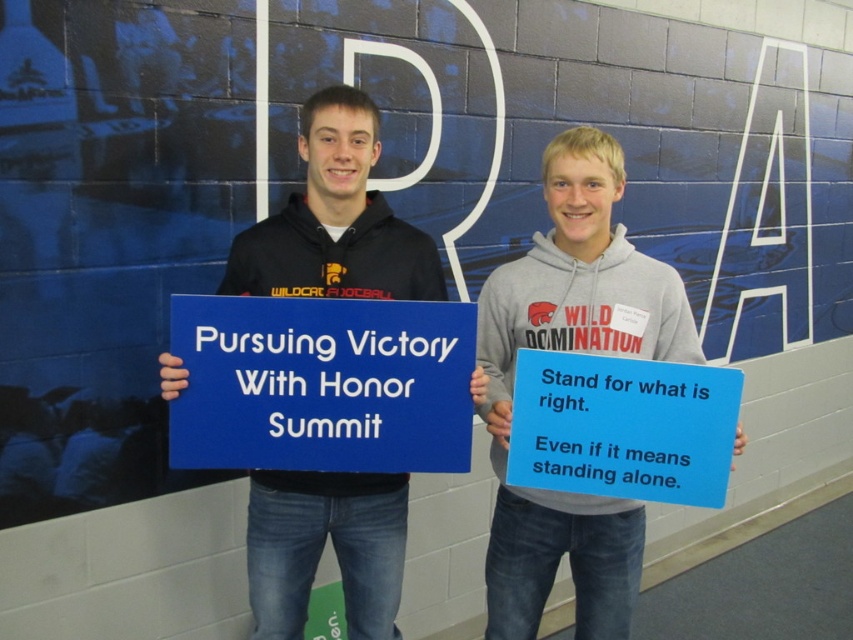
What is the relationship between the matte black hoodie at center and the blue cardstock sign at center in terms of their spatial positioning?

The blue cardstock sign at center is behind the matte black hoodie at center, so the sign is not visible from the front perspective.

You are organizing a community event and need to display two hoodies on a stand. You have a gray hoodie at center and a matte black hoodie at center. Which hoodie should you place on the higher stand to match their sizes as shown in the image?

The gray hoodie at center is taller than the matte black hoodie at center, so you should place the gray hoodie at center on the higher stand to match their sizes as shown in the image.

You are organizing a community event and need to ensure visibility of all items. Given the scene described, which object between the gray hoodie at center and the blue matte sign at center would be more visible from a distance? Explain your reasoning based on their sizes.

The gray hoodie at center is larger in size than the blue matte sign at center, so the gray hoodie at center would be more visible from a distance due to its bigger size.